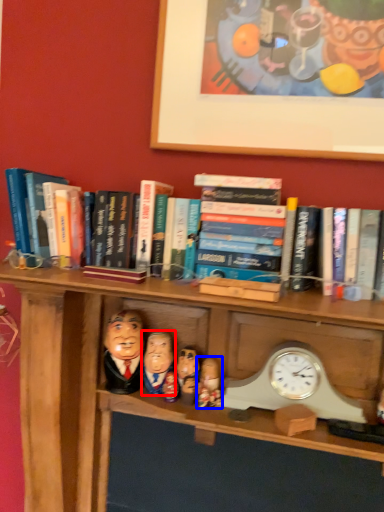
Question: Which object appears farthest to the camera in this image, person (highlighted by a red box) or person (highlighted by a blue box)?

Choices:
 (A) person
 (B) person

Answer: (B)